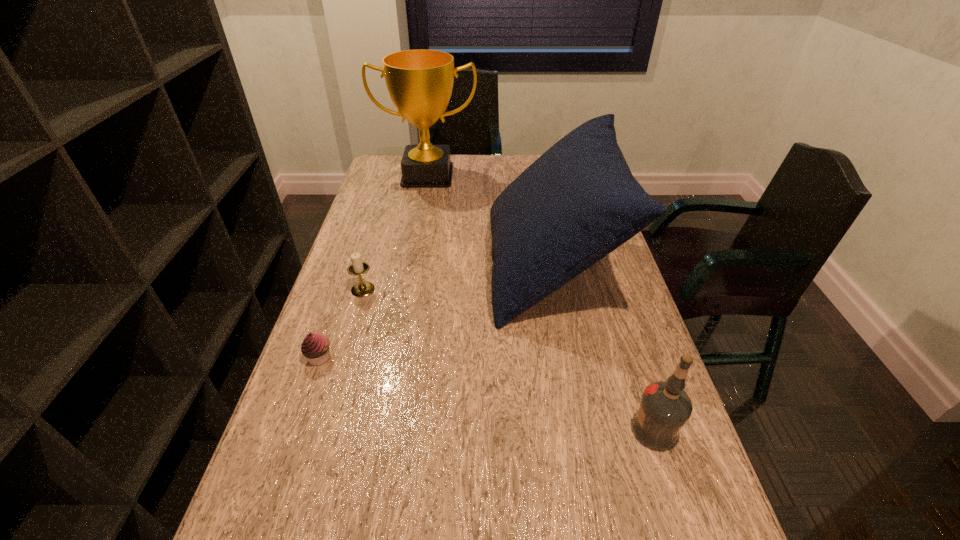
Find the location of a particular element. The image size is (960, 540). award is located at coordinates (420, 82).

The width and height of the screenshot is (960, 540). What are the coordinates of `cushion` in the screenshot? It's located at (578, 202).

This screenshot has height=540, width=960. I want to click on the third tallest object, so click(665, 407).

Locate an element on the screen. Image resolution: width=960 pixels, height=540 pixels. vodka is located at coordinates (665, 407).

You are a GUI agent. You are given a task and a screenshot of the screen. Output one action in this format:
    pyautogui.click(x=<x>, y=<y>)
    Task: Click on the candle holder
    
    Given the screenshot: What is the action you would take?
    pyautogui.click(x=364, y=288)

Locate an element on the screen. This screenshot has width=960, height=540. the fourth farthest object is located at coordinates (315, 347).

Find the location of a particular element. the shortest object is located at coordinates (315, 347).

Where is `vacant space situated 0.400m on the front-facing side of the farthest object`? The image size is (960, 540). vacant space situated 0.400m on the front-facing side of the farthest object is located at coordinates (412, 262).

You are a GUI agent. You are given a task and a screenshot of the screen. Output one action in this format:
    pyautogui.click(x=<x>, y=<y>)
    Task: Click on the vacant area situated 0.090m on the facing side of the cushion
    
    Given the screenshot: What is the action you would take?
    pyautogui.click(x=458, y=267)

I want to click on free location located on the facing side of the cushion, so click(433, 267).